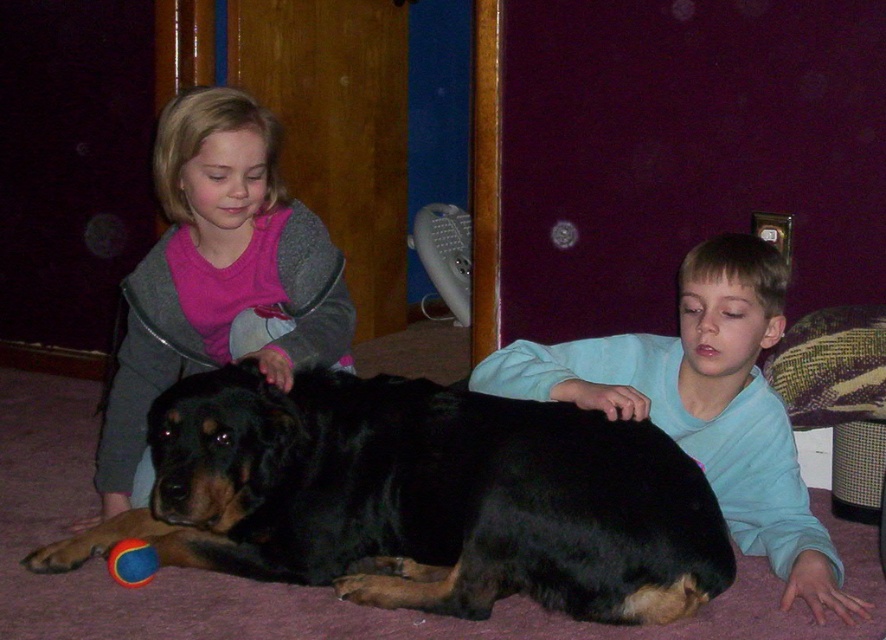
Between black glossy fur at center and rubber ball at lower left, which one appears on the left side from the viewer's perspective?

From the viewer's perspective, rubber ball at lower left appears more on the left side.

Which is more to the right, black glossy fur at center or rubber ball at lower left?

Answer: black glossy fur at center is more to the right.

Which is in front, point (525, 582) or point (125, 552)?

Positioned in front is point (525, 582).

Identify the location of black glossy fur at center. The width and height of the screenshot is (886, 640). (420, 499).

Does black glossy fur at center have a lesser width compared to smooth blue shirt at lower right?

No, black glossy fur at center is not thinner than smooth blue shirt at lower right.

Is black glossy fur at center shorter than smooth blue shirt at lower right?

Yes, black glossy fur at center is shorter than smooth blue shirt at lower right.

Is point (267, 406) farther from camera compared to point (728, 276)?

That is False.

Find the location of `black glossy fur at center`. black glossy fur at center is located at coordinates (420, 499).

Can you confirm if black glossy fur at center is positioned below matte pink shirt at upper left?

Yes.

In the scene shown: Is black glossy fur at center further to camera compared to matte pink shirt at upper left?

No, black glossy fur at center is in front of matte pink shirt at upper left.

Is point (696, 595) farther from camera compared to point (249, 131)?

No, (696, 595) is in front of (249, 131).

Where is `black glossy fur at center`? The height and width of the screenshot is (640, 886). black glossy fur at center is located at coordinates (420, 499).